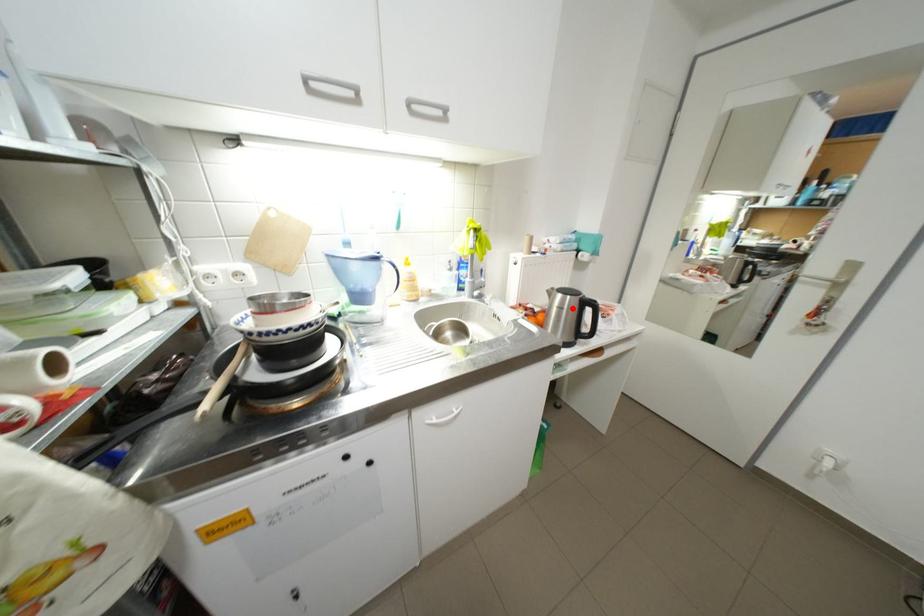
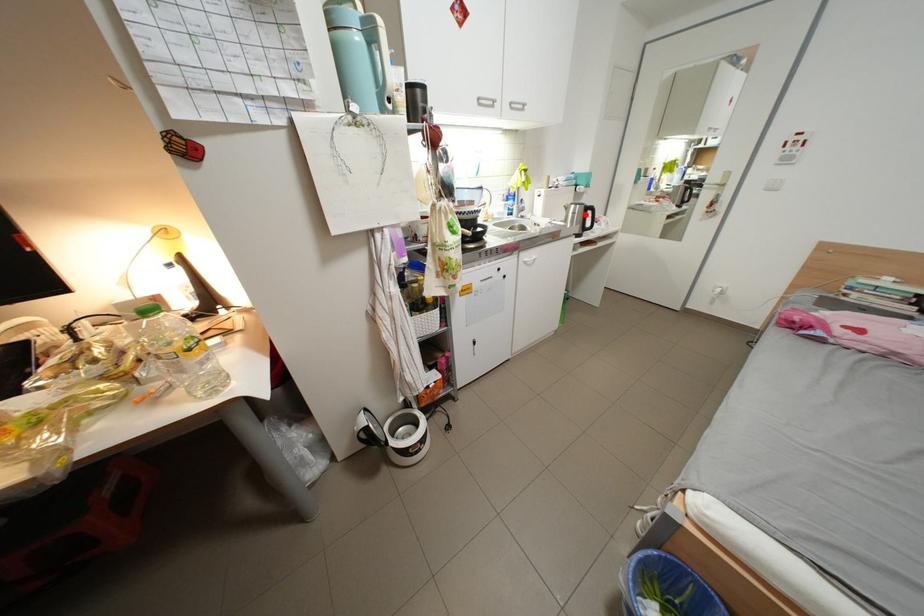
I am providing you with two images of the same scene from different viewpoints. A red point is marked on the first image and another point is marked on the second image. Does the point marked in image1 correspond to the same location as the one in image2?

Yes